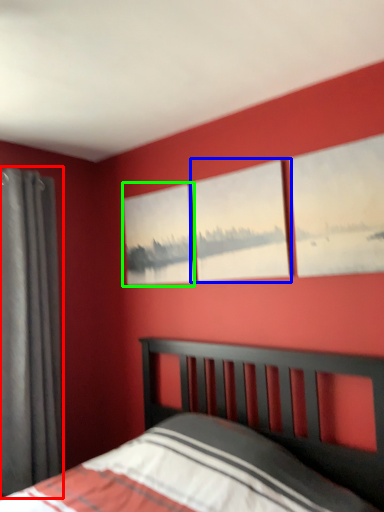
Question: Which is nearer to the curtain (highlighted by a red box)? window (highlighted by a blue box) or picture frame (highlighted by a green box).

Choices:
 (A) window
 (B) picture frame

Answer: (B)